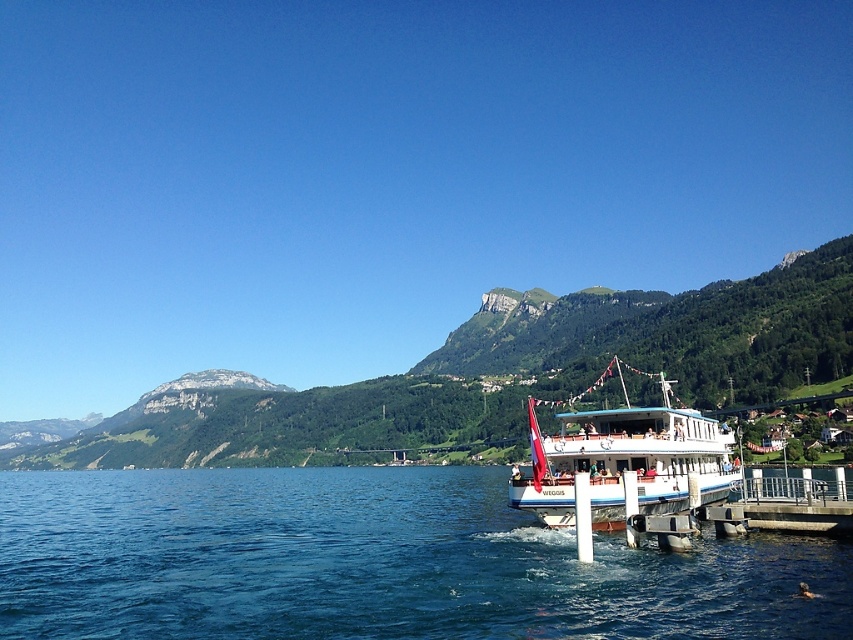
Question: From the image, what is the correct spatial relationship of green grassy mountain at center in relation to white concrete dock at lower right?

Choices:
 (A) right
 (B) left

Answer: (B)

Question: Can you confirm if green grassy mountain at center is positioned below white glossy boat at center?

Choices:
 (A) no
 (B) yes

Answer: (B)

Question: Is white glossy boat at center bigger than white concrete dock at lower right?

Choices:
 (A) no
 (B) yes

Answer: (B)

Question: Estimate the real-world distances between objects in this image. Which object is closer to the white glossy boat at center?

Choices:
 (A) white concrete dock at lower right
 (B) green grassy mountain at center

Answer: (A)

Question: Which is nearer to the white glossy boat at center?

Choices:
 (A) blue water at lower center
 (B) green grassy mountain at center
 (C) white concrete dock at lower right

Answer: (C)

Question: Which object is positioned closest to the blue water at lower center?

Choices:
 (A) green grassy mountain at center
 (B) white concrete dock at lower right
 (C) white glossy boat at center

Answer: (B)